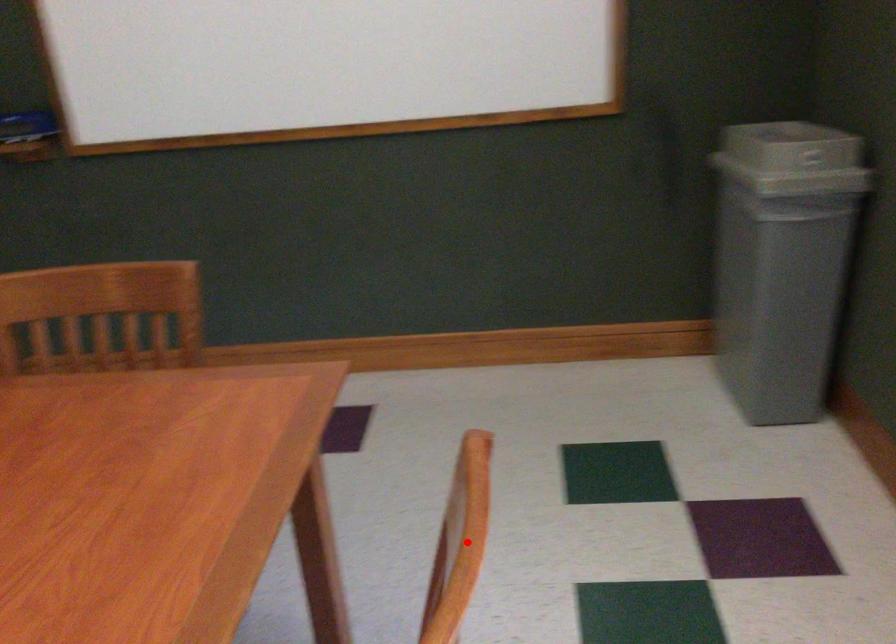
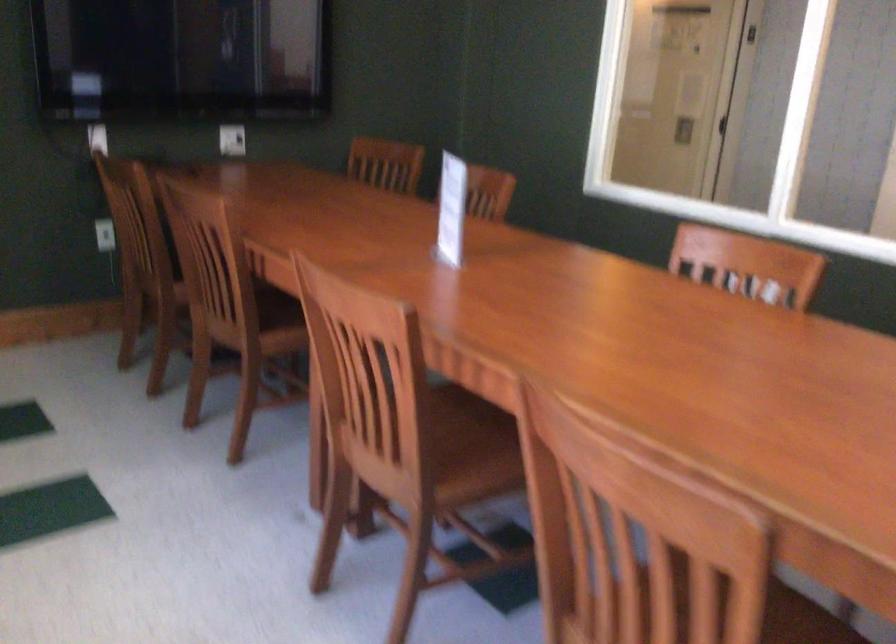
The point at the highlighted location is marked in the first image. Where is the corresponding point in the second image?

(709, 588)